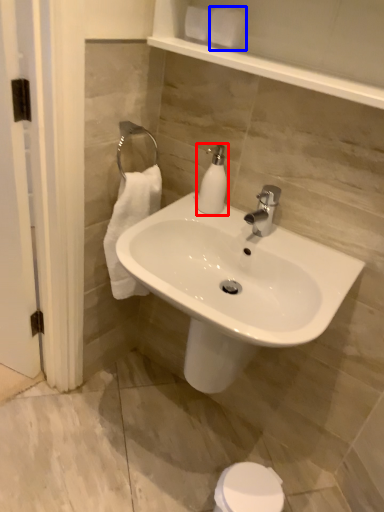
Question: Which of the following is the closest to the observer, soap dispenser (highlighted by a red box) or toilet paper (highlighted by a blue box)?

Choices:
 (A) soap dispenser
 (B) toilet paper

Answer: (B)